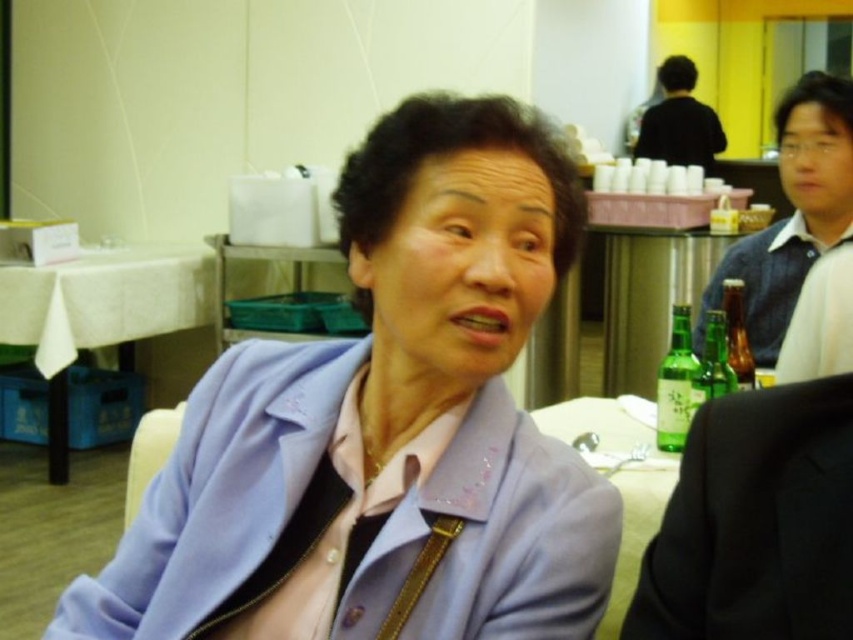
Question: From the image, what is the correct spatial relationship of purple fabric jacket at center in relation to white cloth at center?

Choices:
 (A) above
 (B) below

Answer: (B)

Question: Which point appears farthest from the camera in this image?

Choices:
 (A) (90, 307)
 (B) (636, 141)

Answer: (B)

Question: Where is purple fabric jacket at center located in relation to green glass bottles at right in the image?

Choices:
 (A) right
 (B) left

Answer: (B)

Question: Can you confirm if white cloth at center is positioned above white glossy table at center?

Choices:
 (A) no
 (B) yes

Answer: (B)

Question: Among these objects, which one is nearest to the camera?

Choices:
 (A) purple fabric jacket at center
 (B) white glossy table at center

Answer: (A)

Question: Which is nearer to the white cloth at center?

Choices:
 (A) black suit at right
 (B) white glossy table at center

Answer: (B)